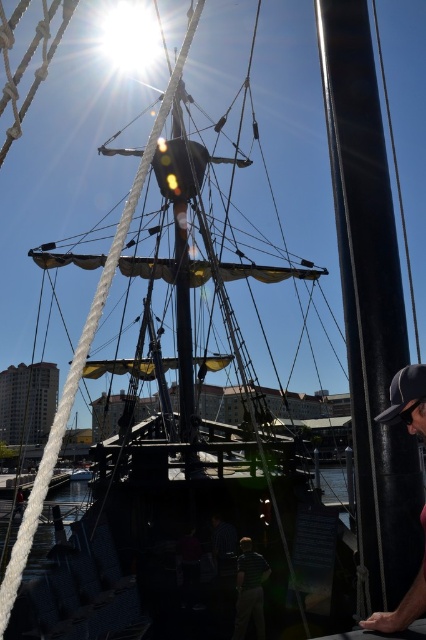
Question: Can you confirm if green striped shirt at center is bigger than black fabric baseball cap at right?

Choices:
 (A) yes
 (B) no

Answer: (A)

Question: Is green striped shirt at center positioned before black fabric baseball cap at right?

Choices:
 (A) yes
 (B) no

Answer: (B)

Question: Is dark gray cap at lower right thinner than green striped shirt at center?

Choices:
 (A) no
 (B) yes

Answer: (B)

Question: Which object appears farthest from the camera in this image?

Choices:
 (A) green striped shirt at center
 (B) dark gray cap at lower right

Answer: (A)

Question: Which object is the closest to the black fabric baseball cap at right?

Choices:
 (A) green striped shirt at center
 (B) dark gray cap at lower right

Answer: (B)

Question: Which point is farther from the camera taking this photo?

Choices:
 (A) (419, 378)
 (B) (238, 576)
 (C) (425, 365)

Answer: (B)